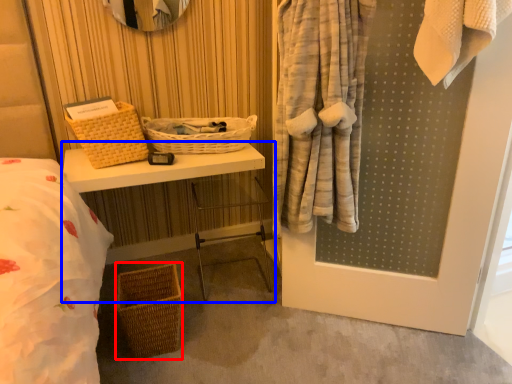
Question: Which point is further to the camera, basket (highlighted by a red box) or table (highlighted by a blue box)?

Choices:
 (A) basket
 (B) table

Answer: (B)